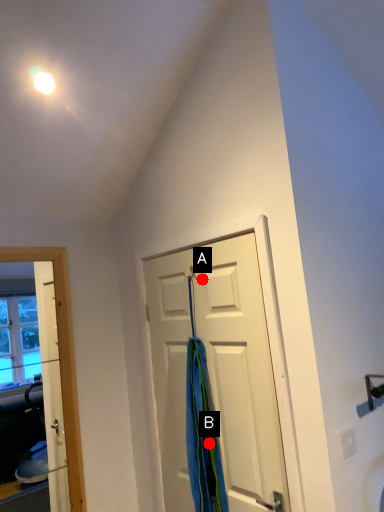
Question: Two points are circled on the image, labeled by A and B beside each circle. Which of the following is the farthest from the observer?

Choices:
 (A) A is further
 (B) B is further

Answer: (A)